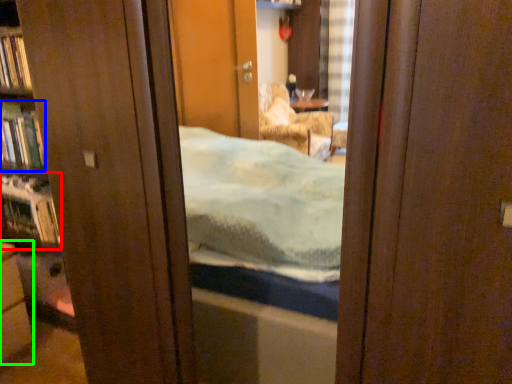
Question: Which object is the closest to the shelf (highlighted by a red box)? Choose among these: book (highlighted by a blue box) or cabinetry (highlighted by a green box).

Choices:
 (A) book
 (B) cabinetry

Answer: (A)